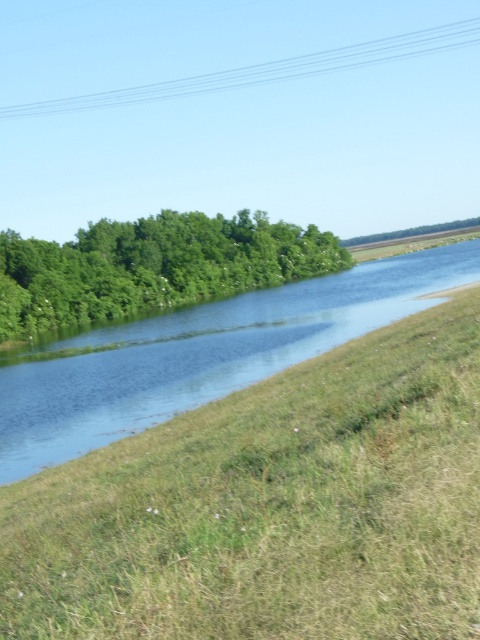
Does blue smooth water at center have a lesser height compared to green leafy trees at center?

Yes.

I want to click on blue smooth water at center, so click(x=200, y=355).